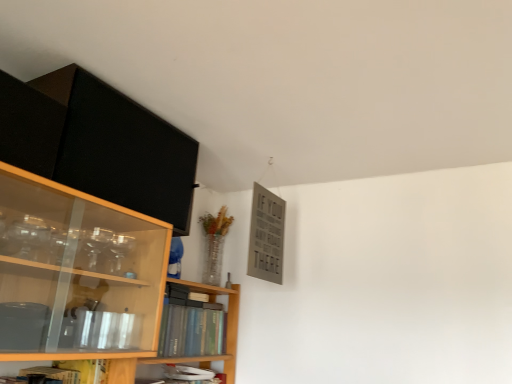
Question: Is point (184, 165) closer or farther from the camera than point (166, 317)?

Choices:
 (A) farther
 (B) closer

Answer: (B)

Question: Is matte black cabinet at upper left situated inside hardcover book at center, the first book when ordered from top to bottom, or outside?

Choices:
 (A) inside
 (B) outside

Answer: (B)

Question: Estimate the real-world distances between objects in this image. Which object is farther from the hardcover book at center, the first book when ordered from top to bottom?

Choices:
 (A) matte black cabinet at upper left
 (B) hardcover book at lower center, placed as the 2th book when sorted from top to bottom

Answer: (A)

Question: Which of these objects is positioned farthest from the matte black cabinet at upper left?

Choices:
 (A) hardcover book at lower center, which is counted as the 1th book, starting from the bottom
 (B) hardcover book at center, which is the second book from bottom to top

Answer: (A)